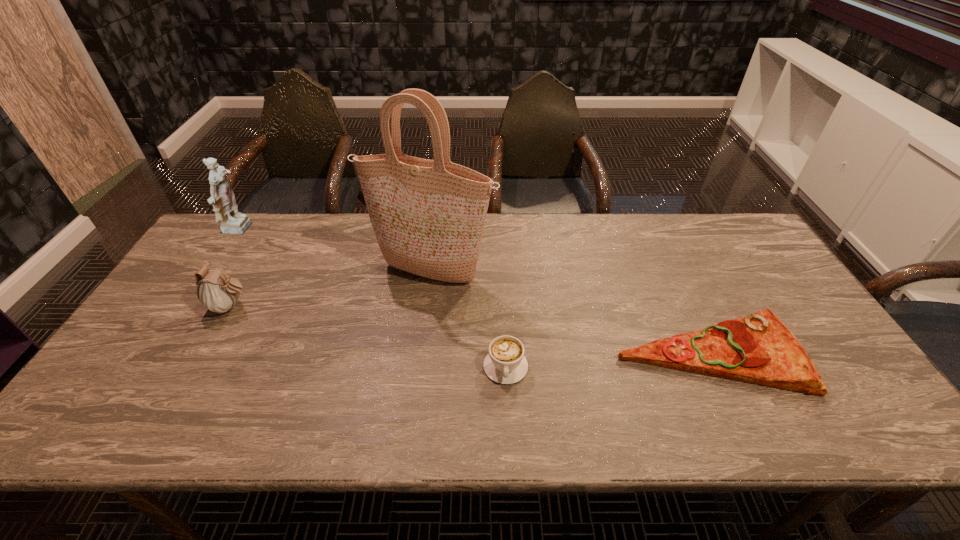
Where is `free space located 0.350m on the front-facing side of the fourth shortest object`? The image size is (960, 540). free space located 0.350m on the front-facing side of the fourth shortest object is located at coordinates (360, 230).

Locate an element on the screen. The height and width of the screenshot is (540, 960). free location located 0.220m on the front-facing side of the fourth object from right to left is located at coordinates (333, 307).

Where is `vacant point located to the right of the second shortest object's handle`? vacant point located to the right of the second shortest object's handle is located at coordinates (508, 410).

Where is `vacant point located on the back of the pizza`? vacant point located on the back of the pizza is located at coordinates (667, 267).

Locate an element on the screen. This screenshot has height=540, width=960. shopping bag that is positioned at the far edge is located at coordinates (428, 216).

The image size is (960, 540). I want to click on figurine positioned at the far edge, so click(222, 198).

Image resolution: width=960 pixels, height=540 pixels. I want to click on figurine present at the left edge, so click(x=222, y=198).

What are the coordinates of `pouch that is at the left edge` in the screenshot? It's located at (217, 292).

Find the location of a particular element. Image resolution: width=960 pixels, height=540 pixels. object situated at the right edge is located at coordinates (759, 349).

Locate an element on the screen. object present at the far left corner is located at coordinates [x=222, y=198].